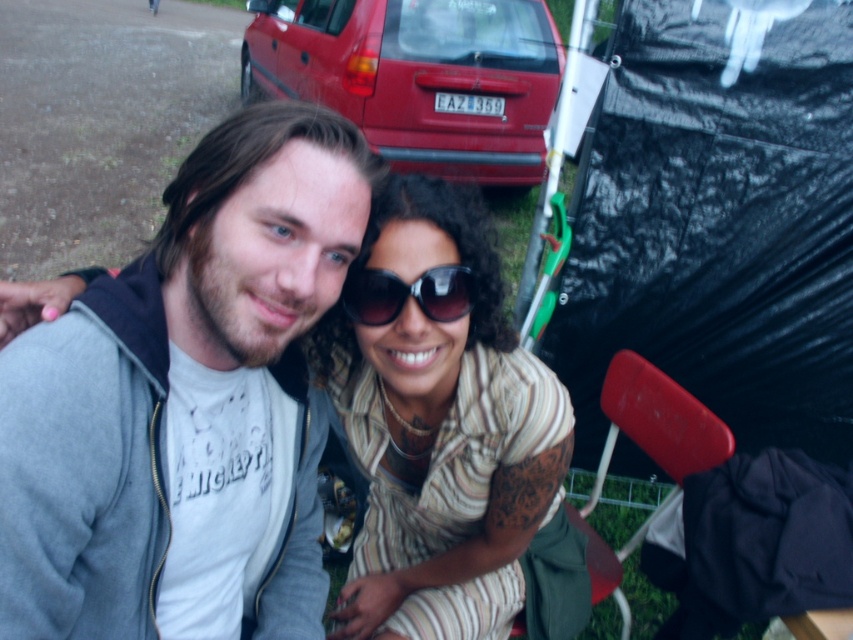
Question: Based on their relative distances, which object is nearer to the striped fabric dress at center?

Choices:
 (A) gray fleece jacket at center
 (B) sunglasses at center
 (C) black plastic tent at right
 (D) red plastic chair at lower right

Answer: (A)

Question: In this image, where is striped fabric dress at center located relative to sunglasses at center?

Choices:
 (A) below
 (B) above

Answer: (A)

Question: Based on their relative distances, which object is farther from the black plastic tent at right?

Choices:
 (A) matte red car at upper center
 (B) striped fabric dress at center

Answer: (A)

Question: Does black plastic tent at right appear on the right side of matte red car at upper center?

Choices:
 (A) yes
 (B) no

Answer: (A)

Question: Is striped fabric dress at center thinner than red plastic chair at lower right?

Choices:
 (A) yes
 (B) no

Answer: (B)

Question: Estimate the real-world distances between objects in this image. Which object is farther from the sunglasses at center?

Choices:
 (A) red plastic chair at lower right
 (B) gray fleece jacket at center
 (C) striped fabric dress at center
 (D) matte red car at upper center

Answer: (D)